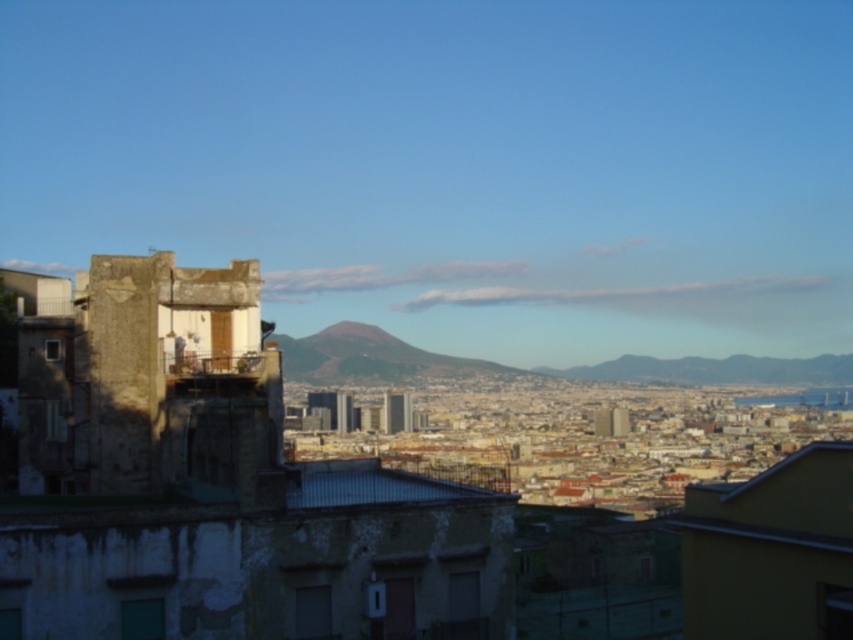
Question: Considering the relative positions of volcanic rock mountain at center and rugged stone mountain at center in the image provided, where is volcanic rock mountain at center located with respect to rugged stone mountain at center?

Choices:
 (A) right
 (B) left

Answer: (B)

Question: Among these points, which one is nearest to the camera?

Choices:
 (A) (305, 364)
 (B) (627, 380)

Answer: (A)

Question: Which object is farther from the camera taking this photo?

Choices:
 (A) volcanic rock mountain at center
 (B) rugged stone mountain at center

Answer: (B)

Question: Where is volcanic rock mountain at center located in relation to rugged stone mountain at center in the image?

Choices:
 (A) right
 (B) left

Answer: (B)

Question: Can you confirm if volcanic rock mountain at center is positioned above rugged stone mountain at center?

Choices:
 (A) yes
 (B) no

Answer: (A)